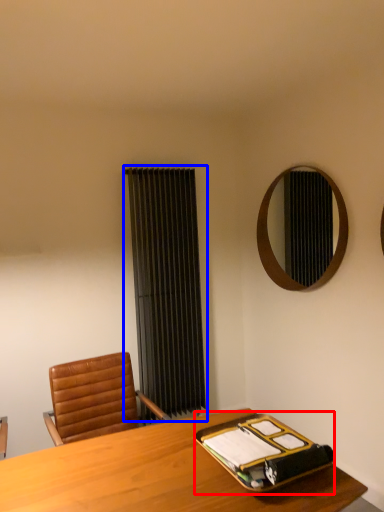
Question: Among these objects, which one is farthest to the camera, binder (highlighted by a red box) or curtain (highlighted by a blue box)?

Choices:
 (A) binder
 (B) curtain

Answer: (B)